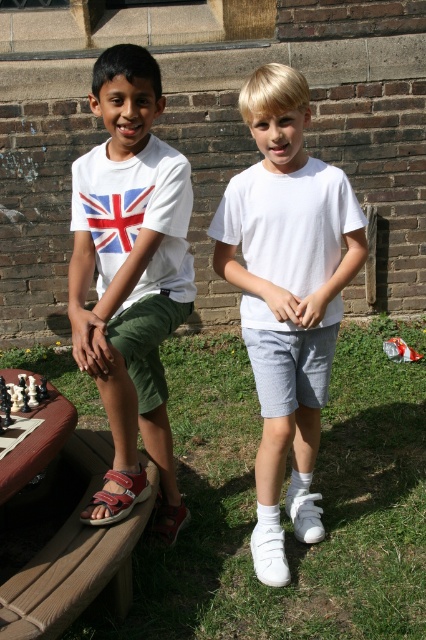
Which is more to the left, white matte shorts at center or matte white t-shirt at left?

matte white t-shirt at left is more to the left.

This screenshot has width=426, height=640. Describe the element at coordinates (287, 296) in the screenshot. I see `white matte shorts at center` at that location.

At what (x,y) coordinates should I click in order to perform the action: click on white matte shorts at center. Please return your answer as a coordinate pair (x, y). This screenshot has width=426, height=640. Looking at the image, I should click on (287, 296).